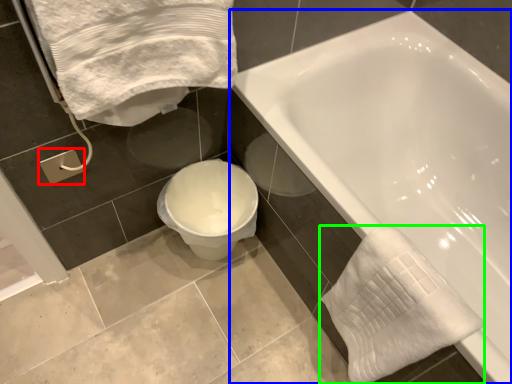
Question: Estimate the real-world distances between objects in this image. Which object is farther from towel bar (highlighted by a red box), bathtub (highlighted by a blue box) or bath towel (highlighted by a green box)?

Choices:
 (A) bathtub
 (B) bath towel

Answer: (A)